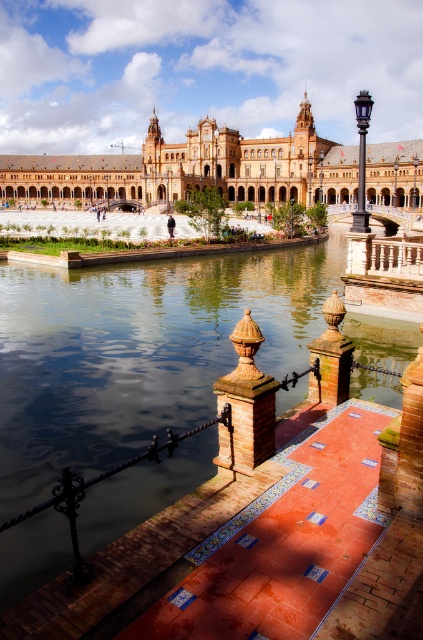
Question: Among these objects, which one is nearest to the camera?

Choices:
 (A) polished bronze pillar at center
 (B) matte stone palace at center

Answer: (A)

Question: Does clear water at center have a lesser width compared to matte stone palace at center?

Choices:
 (A) yes
 (B) no

Answer: (A)

Question: Is clear water at center wider than terracotta textured pillar at center?

Choices:
 (A) yes
 (B) no

Answer: (A)

Question: Which object is closer to the camera taking this photo?

Choices:
 (A) polished bronze pillar at center
 (B) clear water at center
 (C) matte stone palace at center

Answer: (B)

Question: Among these points, which one is farthest from the camera?

Choices:
 (A) (241, 396)
 (B) (316, 384)
 (C) (156, 401)
 (D) (151, 150)

Answer: (D)

Question: Does matte stone palace at center have a lesser width compared to terracotta textured pillar at center?

Choices:
 (A) no
 (B) yes

Answer: (A)